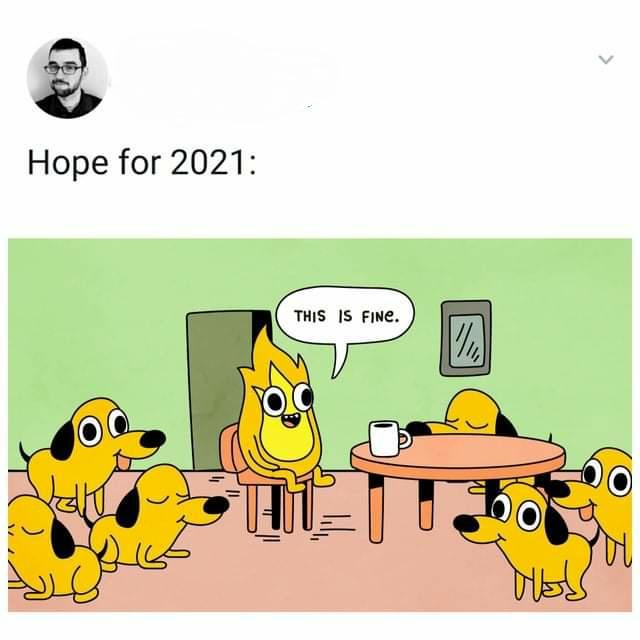
I want to click on green walls, so click(114, 336), click(281, 272), click(550, 335), click(395, 387).